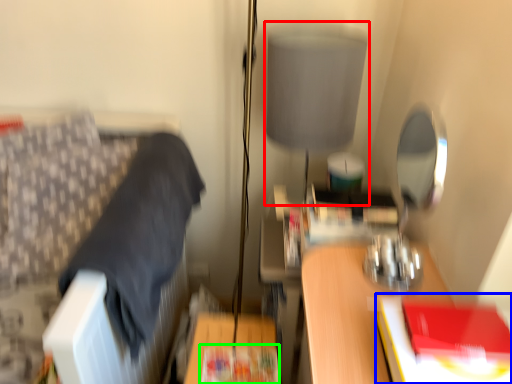
Question: Which object is the closest to the table lamp (highlighted by a red box)? Choose among these: paperback book (highlighted by a blue box) or paperback book (highlighted by a green box).

Choices:
 (A) paperback book
 (B) paperback book

Answer: (A)